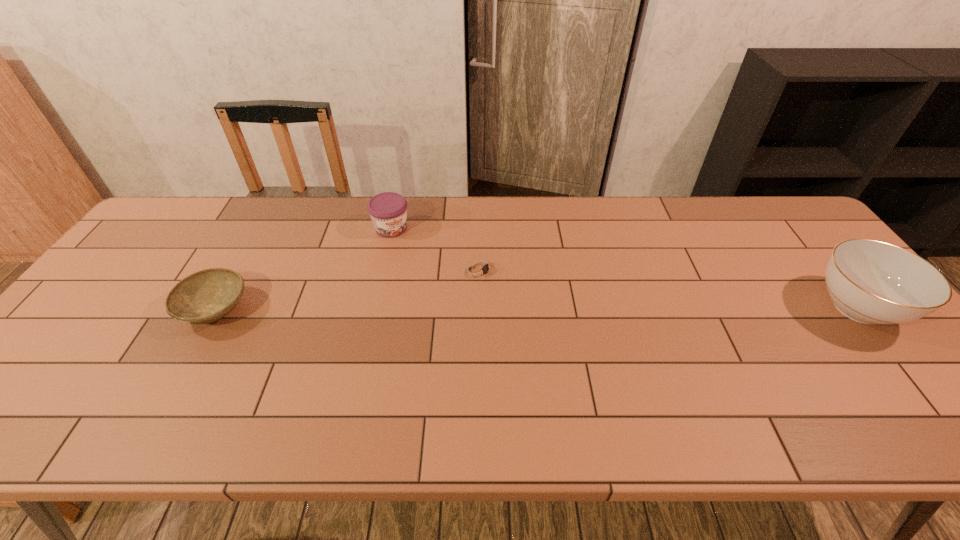
Where is `the leftmost object`? The image size is (960, 540). the leftmost object is located at coordinates (206, 296).

What are the coordinates of `the third tallest object` in the screenshot? It's located at (206, 296).

You are a GUI agent. You are given a task and a screenshot of the screen. Output one action in this format:
    pyautogui.click(x=<x>, y=<y>)
    Task: Click on the rightmost object
    The image size is (960, 540).
    Given the screenshot: What is the action you would take?
    pyautogui.click(x=873, y=282)

Find the location of a particular element. chinaware is located at coordinates (873, 282).

The width and height of the screenshot is (960, 540). Find the location of `the shortest object`. the shortest object is located at coordinates (479, 269).

Image resolution: width=960 pixels, height=540 pixels. Identify the location of watch. point(479,269).

Find the location of `the third object from right to left`. the third object from right to left is located at coordinates (388, 211).

The height and width of the screenshot is (540, 960). Identify the location of the farthest object. (388, 211).

The height and width of the screenshot is (540, 960). I want to click on vacant region located 0.100m on the left of the leftmost object, so click(142, 310).

Locate an element on the screen. Image resolution: width=960 pixels, height=540 pixels. blank space located on the left of the tallest object is located at coordinates (765, 308).